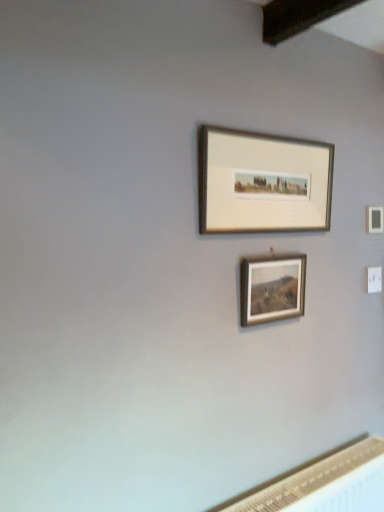
In order to face white textured radiator at lower right, should I rotate leftwards or rightwards?

To align with it, rotate right about 17.063°.

You are a GUI agent. You are given a task and a screenshot of the screen. Output one action in this format:
    pyautogui.click(x=<x>, y=<y>)
    Task: Click on the silver metallic picture frame at upper center, which ranks as the second picture frame in bottom-to-top order
    
    Given the screenshot: What is the action you would take?
    pyautogui.click(x=262, y=182)

Describe the element at coordinates (272, 289) in the screenshot. The image size is (384, 512). I see `wooden frame at center, the 2th picture frame positioned from the top` at that location.

Locate an element on the screen. Image resolution: width=384 pixels, height=512 pixels. white textured radiator at lower right is located at coordinates (325, 483).

Is white textured radiator at lower right taller than wooden frame at center, the 2th picture frame positioned from the top?

Yes.

Is the position of white textured radiator at lower right less distant than that of wooden frame at center, the 2th picture frame positioned from the top?

That is True.

From a real-world perspective, is white textured radiator at lower right on wooden frame at center, the 2th picture frame positioned from the top?

Actually, white textured radiator at lower right is physically below wooden frame at center, the 2th picture frame positioned from the top, in the real world.

From the image's perspective, is white textured radiator at lower right on top of wooden frame at center, the 1th picture frame from the bottom?

Actually, white textured radiator at lower right appears below wooden frame at center, the 1th picture frame from the bottom, in the image.

From a real-world perspective, which object rests below the other?

From a 3D spatial view, wooden frame at center, the 2th picture frame positioned from the top, is below.

Does wooden frame at center, the 1th picture frame from the bottom, have a greater width compared to silver metallic picture frame at upper center, which ranks as the second picture frame in bottom-to-top order?

No.

Is wooden frame at center, the 2th picture frame positioned from the top, smaller than silver metallic picture frame at upper center, which ranks as the second picture frame in bottom-to-top order?

Yes.

Is wooden frame at center, the 1th picture frame from the bottom, positioned before silver metallic picture frame at upper center, the first picture frame from the top?

That is False.

Is silver metallic picture frame at upper center, the first picture frame from the top, shorter than white textured radiator at lower right?

Correct, silver metallic picture frame at upper center, the first picture frame from the top, is not as tall as white textured radiator at lower right.

Is point (318, 154) closer or farther from the camera than point (347, 486)?

Clearly, point (318, 154) is more distant from the camera than point (347, 486).

From the image's perspective, is white textured radiator at lower right on silver metallic picture frame at upper center, the first picture frame from the top?

Incorrect, from the image's perspective, white textured radiator at lower right is lower than silver metallic picture frame at upper center, the first picture frame from the top.

How many degrees apart are the facing directions of white textured radiator at lower right and silver metallic picture frame at upper center, the first picture frame from the top?

0.00508 degrees separate the facing orientations of white textured radiator at lower right and silver metallic picture frame at upper center, the first picture frame from the top.

Considering the relative positions of white textured radiator at lower right and silver metallic picture frame at upper center, the first picture frame from the top, in the image provided, is white textured radiator at lower right to the right of silver metallic picture frame at upper center, the first picture frame from the top, from the viewer's perspective?

Indeed, white textured radiator at lower right is positioned on the right side of silver metallic picture frame at upper center, the first picture frame from the top.

Considering the relative sizes of white textured radiator at lower right and silver metallic picture frame at upper center, the first picture frame from the top, in the image provided, is white textured radiator at lower right taller than silver metallic picture frame at upper center, the first picture frame from the top,?

Yes.

Would you say wooden frame at center, the 2th picture frame positioned from the top, is part of silver metallic picture frame at upper center, which ranks as the second picture frame in bottom-to-top order,'s contents?

Definitely not — wooden frame at center, the 2th picture frame positioned from the top, is not inside silver metallic picture frame at upper center, which ranks as the second picture frame in bottom-to-top order.

Is silver metallic picture frame at upper center, the first picture frame from the top, turned away from wooden frame at center, the 2th picture frame positioned from the top?

No.

From a real-world perspective, is silver metallic picture frame at upper center, which ranks as the second picture frame in bottom-to-top order, on top of wooden frame at center, the 1th picture frame from the bottom?

Yes, from a real-world perspective, silver metallic picture frame at upper center, which ranks as the second picture frame in bottom-to-top order, is on top of wooden frame at center, the 1th picture frame from the bottom.

Can you confirm if wooden frame at center, the 2th picture frame positioned from the top, is taller than white textured radiator at lower right?

In fact, wooden frame at center, the 2th picture frame positioned from the top, may be shorter than white textured radiator at lower right.

What's the angular difference between wooden frame at center, the 1th picture frame from the bottom, and white textured radiator at lower right's facing directions?

There is a 0.003-degree angle between the facing directions of wooden frame at center, the 1th picture frame from the bottom, and white textured radiator at lower right.

Can you confirm if wooden frame at center, the 2th picture frame positioned from the top, is positioned to the left of white textured radiator at lower right?

Correct, you'll find wooden frame at center, the 2th picture frame positioned from the top, to the left of white textured radiator at lower right.

Where is `picture frame that is the 1st one when counting leftward from the white textured radiator at lower right`? Image resolution: width=384 pixels, height=512 pixels. picture frame that is the 1st one when counting leftward from the white textured radiator at lower right is located at coordinates (272, 289).

Locate an element on the screen. The height and width of the screenshot is (512, 384). picture frame behind the silver metallic picture frame at upper center, which ranks as the second picture frame in bottom-to-top order is located at coordinates [x=272, y=289].

Estimate the real-world distances between objects in this image. Which object is closer to silver metallic picture frame at upper center, the first picture frame from the top, white textured radiator at lower right or wooden frame at center, the 1th picture frame from the bottom?

Based on the image, wooden frame at center, the 1th picture frame from the bottom, appears to be nearer to silver metallic picture frame at upper center, the first picture frame from the top.

Considering their positions, is silver metallic picture frame at upper center, which ranks as the second picture frame in bottom-to-top order, positioned further to white textured radiator at lower right than wooden frame at center, the 1th picture frame from the bottom?

silver metallic picture frame at upper center, which ranks as the second picture frame in bottom-to-top order, is further to white textured radiator at lower right.

Looking at the image, which one is located further to silver metallic picture frame at upper center, which ranks as the second picture frame in bottom-to-top order, wooden frame at center, the 2th picture frame positioned from the top, or white textured radiator at lower right?

The object further to silver metallic picture frame at upper center, which ranks as the second picture frame in bottom-to-top order, is white textured radiator at lower right.

Considering their positions, is wooden frame at center, the 1th picture frame from the bottom, positioned closer to white textured radiator at lower right than silver metallic picture frame at upper center, which ranks as the second picture frame in bottom-to-top order?

wooden frame at center, the 1th picture frame from the bottom.

Considering their positions, is white textured radiator at lower right positioned closer to wooden frame at center, the 2th picture frame positioned from the top, than silver metallic picture frame at upper center, the first picture frame from the top?

silver metallic picture frame at upper center, the first picture frame from the top, lies closer to wooden frame at center, the 2th picture frame positioned from the top, than the other object.

Considering their positions, is silver metallic picture frame at upper center, which ranks as the second picture frame in bottom-to-top order, positioned further to wooden frame at center, the 1th picture frame from the bottom, than white textured radiator at lower right?

white textured radiator at lower right is positioned further to the anchor wooden frame at center, the 1th picture frame from the bottom.

I want to click on picture frame between silver metallic picture frame at upper center, which ranks as the second picture frame in bottom-to-top order, and white textured radiator at lower right vertically, so click(x=272, y=289).